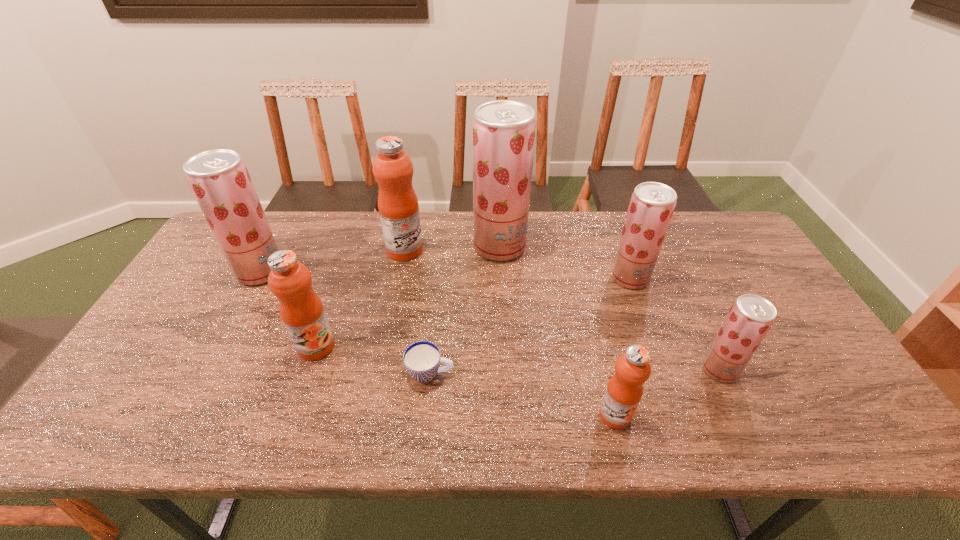
Find the location of a particular element. The image size is (960, 540). the nearest strawberry fruit juice is located at coordinates (750, 318).

The width and height of the screenshot is (960, 540). I want to click on the rightmost fruit juice, so click(x=750, y=318).

Locate an element on the screen. the nearest object is located at coordinates (624, 390).

Identify the location of the nearest orange fruit juice. (624, 390).

This screenshot has width=960, height=540. I want to click on the fifth object from right to left, so click(422, 359).

Identify the location of cup. (422, 359).

The height and width of the screenshot is (540, 960). Find the location of `free space located on the left of the tallest fruit juice`. free space located on the left of the tallest fruit juice is located at coordinates (372, 246).

What are the coordinates of `vacant space located 0.270m on the right of the second biggest strawberry fruit juice` in the screenshot? It's located at (372, 271).

Identify the location of vacant position located 0.110m on the front label of the fifth fruit juice from right to left. The image size is (960, 540). (457, 250).

Identify the location of free space located on the left of the seventh object from left to right. (525, 278).